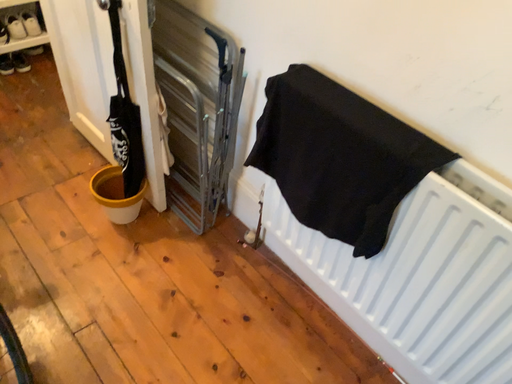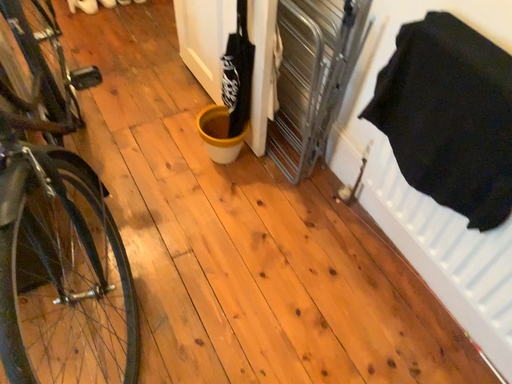
Question: Which way did the camera rotate in the video?

Choices:
 (A) rotated right
 (B) rotated left

Answer: (B)